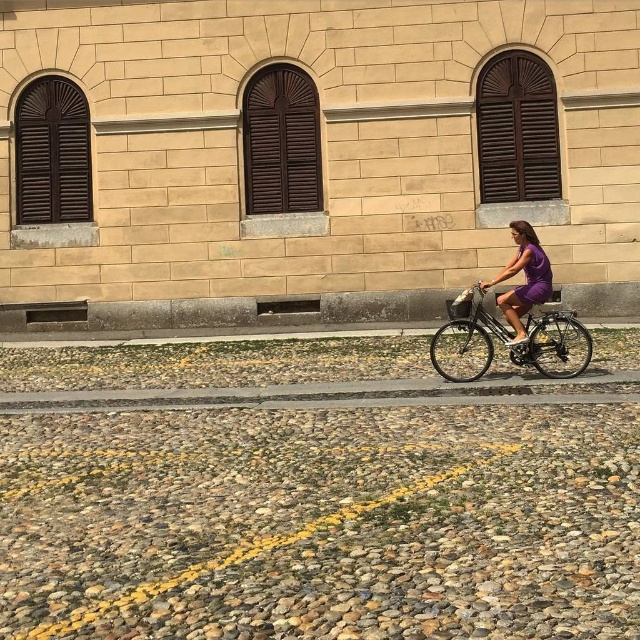
You are standing at the point marked by the coordinates point (509, 339). Looking around, you see a shiny metallic bicycle at right. Which direction should you face to see the beige stone building with three arched windows?

The point (509, 339) marks the shiny metallic bicycle at right, so if you are standing there, you should face left to see the beige stone building with three arched windows.

You are standing at the center of the cobblestone street in front of the beige stone building. You want to know the exact position of the shiny metallic bicycle at right. Can you tell me its coordinates?

The shiny metallic bicycle at right is located at coordinates (509, 339).

You are standing on the cobblestone street and want to take a photo of both the shiny metallic bicycle at right and the purple matte dress at center. Which object should you focus on first to ensure both are in clear view?

You should focus on the shiny metallic bicycle at right first because it is closer to you than the purple matte dress at center, ensuring both will be in clear view when focused properly.